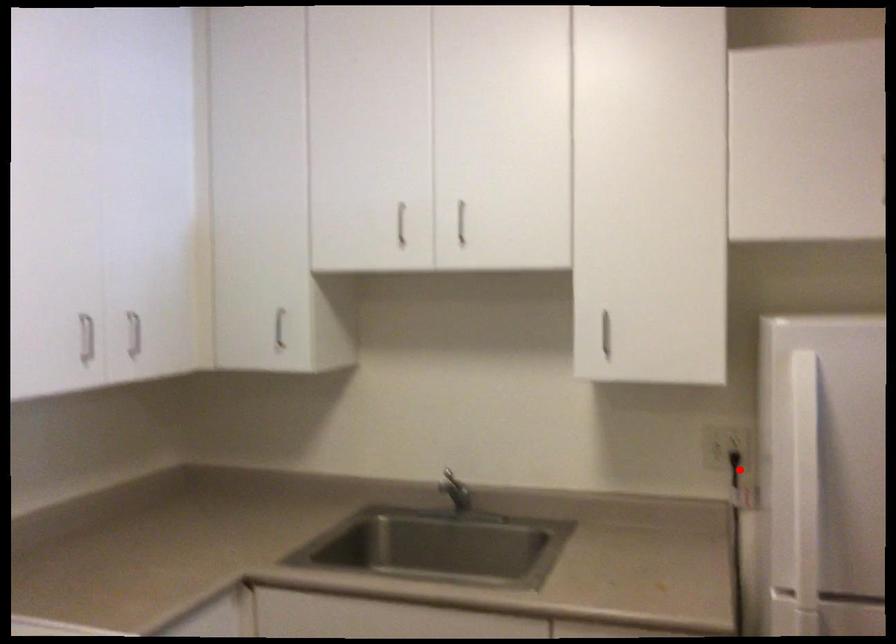
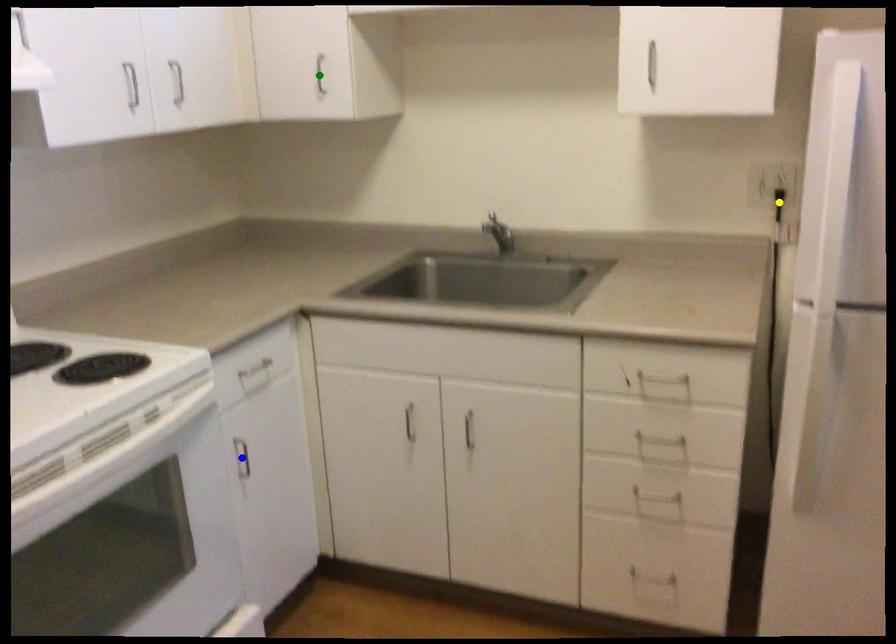
Question: I am providing you with two images of the same scene from different viewpoints. A red point is marked on the first image. You are given multiple points on the second image. Which mark in image 2 goes with the point in image 1?

Choices:
 (A) green point
 (B) blue point
 (C) yellow point

Answer: (C)